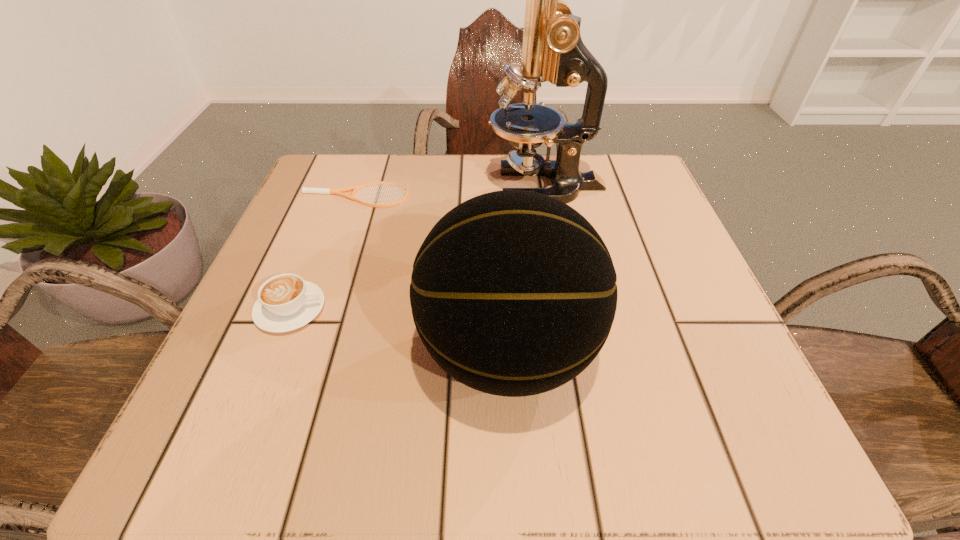
Identify the location of vacant space that satisfies the following two spatial constraints: 1. on the front side of the tennis racket; 2. on the side of the second shortest object with the handle. The image size is (960, 540). (316, 309).

This screenshot has width=960, height=540. I want to click on blank area in the image that satisfies the following two spatial constraints: 1. on the side of the cappuccino with the handle; 2. on the back side of the basketball, so tap(274, 352).

Where is `vacant space that satisfies the following two spatial constraints: 1. on the front side of the tennis racket; 2. on the right side of the third shortest object`? The image size is (960, 540). vacant space that satisfies the following two spatial constraints: 1. on the front side of the tennis racket; 2. on the right side of the third shortest object is located at coordinates (301, 352).

This screenshot has width=960, height=540. I want to click on blank area in the image that satisfies the following two spatial constraints: 1. on the side of the cappuccino with the handle; 2. on the back side of the second tallest object, so click(x=274, y=352).